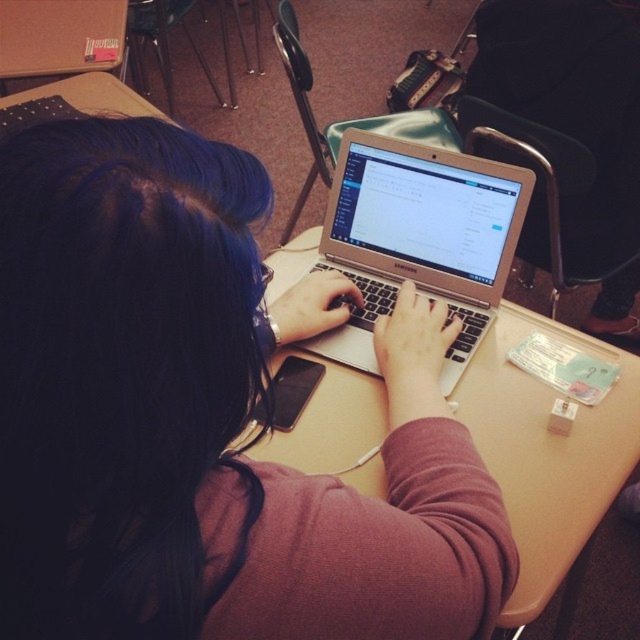
Can you confirm if beige wood table at center is positioned to the left of silver metallic laptop at center?

No, beige wood table at center is not to the left of silver metallic laptop at center.

Is beige wood table at center smaller than silver metallic laptop at center?

No.

Which is behind, point (612, 499) or point (476, 240)?

Positioned behind is point (476, 240).

At what (x,y) coordinates should I click in order to perform the action: click on beige wood table at center. Please return your answer as a coordinate pair (x, y). The width and height of the screenshot is (640, 640). Looking at the image, I should click on (548, 456).

Is point (420, 516) less distant than point (508, 513)?

Yes, point (420, 516) is closer to viewer.

Is matte silver laptop at center thinner than beige wood table at center?

Indeed, matte silver laptop at center has a lesser width compared to beige wood table at center.

Locate an element on the screen. This screenshot has height=640, width=640. matte silver laptop at center is located at coordinates (205, 419).

From the picture: Is matte silver laptop at center in front of silver metallic laptop at center?

Yes, matte silver laptop at center is in front of silver metallic laptop at center.

Can you confirm if matte silver laptop at center is positioned to the right of silver metallic laptop at center?

In fact, matte silver laptop at center is to the left of silver metallic laptop at center.

Is point (461, 625) closer to viewer compared to point (380, 301)?

Yes.

Where is `matte silver laptop at center`? matte silver laptop at center is located at coordinates (205, 419).